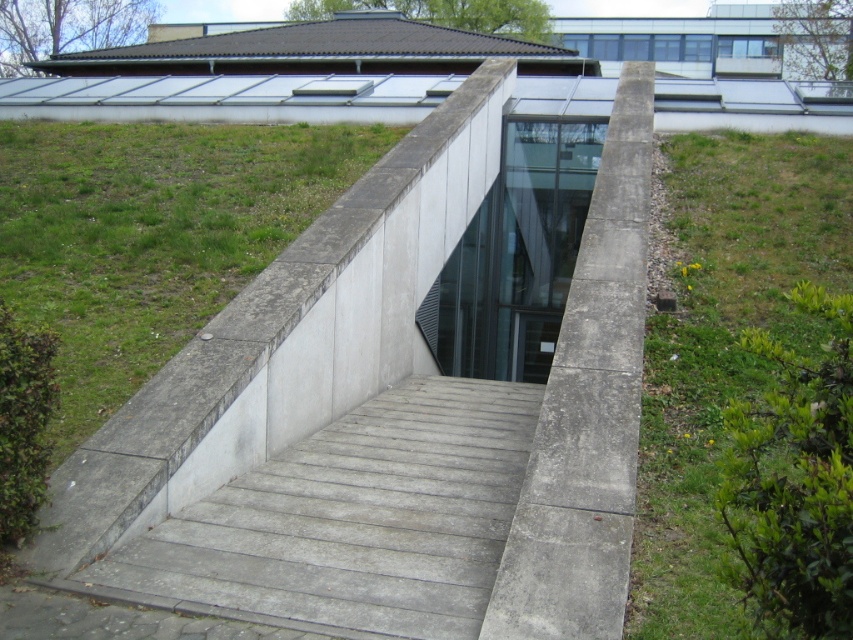
You are standing at the entrance of the architectural structure and want to move towards the point that is closer to the camera between the two points, point [349,481] and point [672,316]. Which point should you head towards?

You should head towards point [349,481] because it is closer to the camera than point [672,316].

You are planning to install a new garden feature and need to know which area has more space available. Based on the scene, which object has more space available between the concrete stairs at center and the green grass at lower right?

The green grass at lower right has more space available because it occupies more area than the concrete stairs at center.